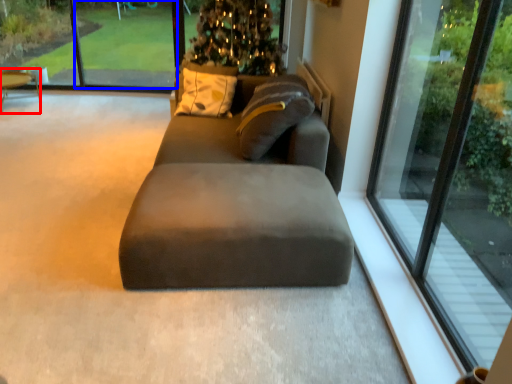
Question: Which object is closer to the camera taking this photo, table (highlighted by a red box) or window screen (highlighted by a blue box)?

Choices:
 (A) table
 (B) window screen

Answer: (A)